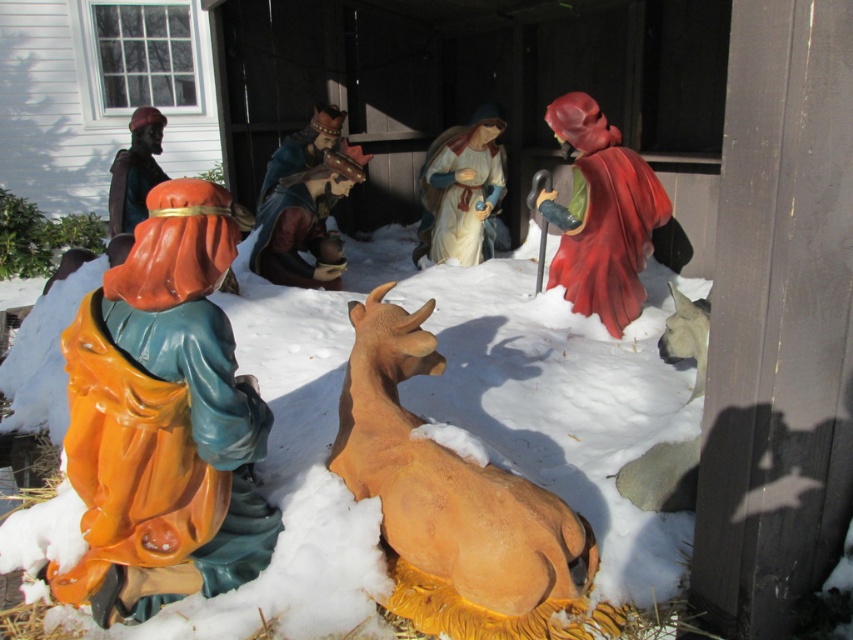
You are a child who wants to place a small toy mouse between the matte brown cow at center and the matte plastic baby at center in the nativity scene. Based on their positions, where should you place the mouse so it sits between them?

The matte brown cow at center is located below the matte plastic baby at center, so to place the mouse between them, position it in the space directly above the cow and below the baby.

You are a photographer setting up a shot of the nativity scene. You want to ensure that both the matte black figure at upper left and the matte plastic king at center are clearly visible in your frame. Based on their positions, which figure is positioned lower in the image?

The matte black figure at upper left is located below the matte plastic king at center, so it is positioned lower in the image.

You are setting up a Christmas display and need to place the white matte snow at center and the matte black figure at upper left. Based on their heights, which one should you place first to ensure proper positioning?

The white matte snow at center is taller than the matte black figure at upper left, so you should place the white matte snow at center first to ensure the matte black figure at upper left can be positioned appropriately on top or around it.